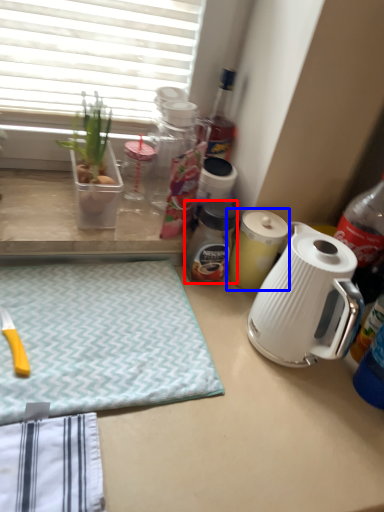
Question: Among these objects, which one is farthest to the camera, bottle (highlighted by a red box) or kitchen appliance (highlighted by a blue box)?

Choices:
 (A) bottle
 (B) kitchen appliance

Answer: (B)